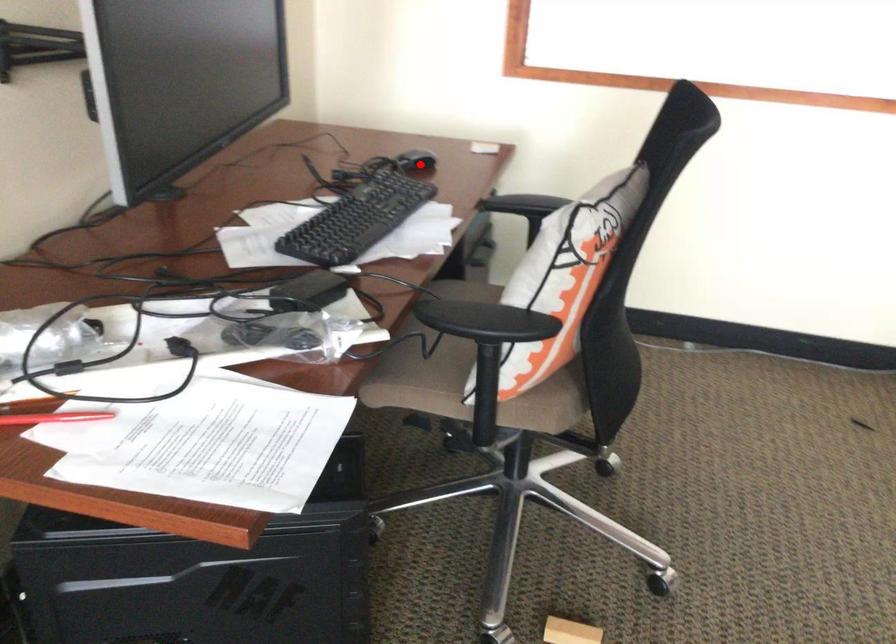
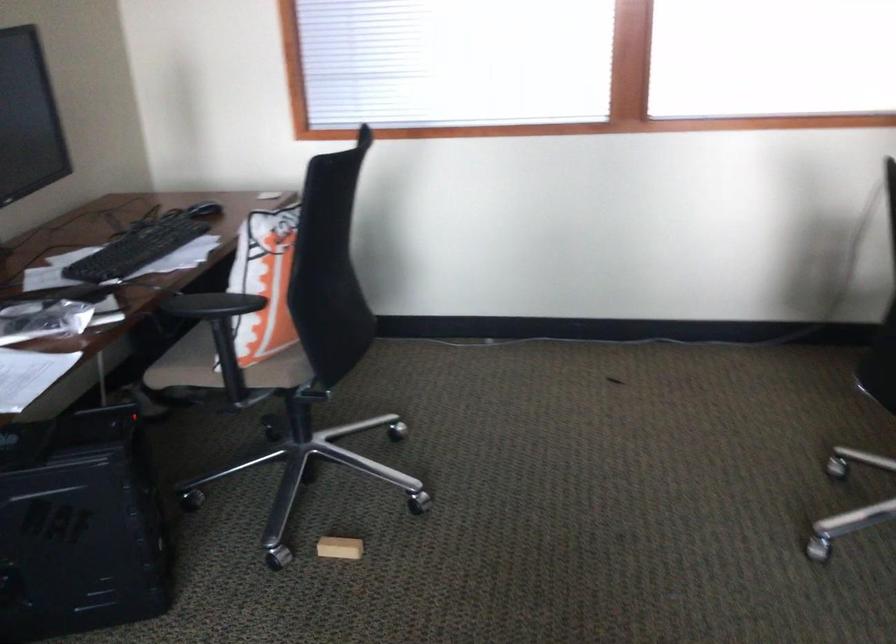
Find the pixel in the second image that matches the highlighted location in the first image.

(204, 210)